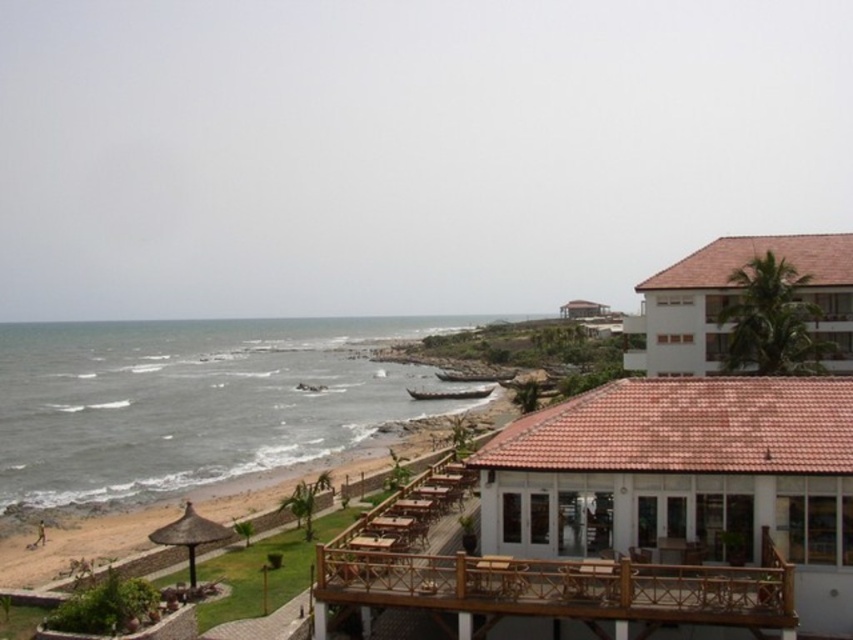
Does wooden at lower right have a larger size compared to white matte building at right?

Incorrect, wooden at lower right is not larger than white matte building at right.

Between point (381, 573) and point (837, 278), which one is positioned in front?

Point (381, 573) is in front.

Locate an element on the screen. Image resolution: width=853 pixels, height=640 pixels. wooden at lower right is located at coordinates (555, 589).

Between wooden at lower right and smooth sand beach at lower left, which one is positioned lower?

smooth sand beach at lower left is below.

Between wooden at lower right and smooth sand beach at lower left, which one has less height?

With less height is smooth sand beach at lower left.

Who is more forward, (312, 632) or (262, 516)?

Point (312, 632)

Identify the location of wooden at lower right. (555, 589).

Looking at this image, is brown tile roof at upper right taller than white matte building at right?

No, brown tile roof at upper right is not taller than white matte building at right.

Is brown tile roof at upper right positioned at the back of white matte building at right?

No, it is in front of white matte building at right.

Which is in front, point (813, 476) or point (761, 244)?

Point (813, 476)

The width and height of the screenshot is (853, 640). In order to click on brown tile roof at upper right in this screenshot , I will do `click(685, 477)`.